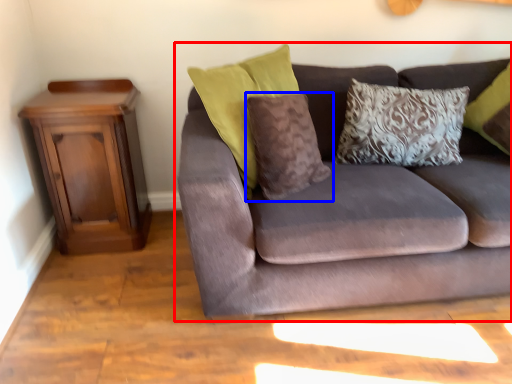
Question: Among these objects, which one is farthest to the camera, studio couch (highlighted by a red box) or pillow (highlighted by a blue box)?

Choices:
 (A) studio couch
 (B) pillow

Answer: (B)